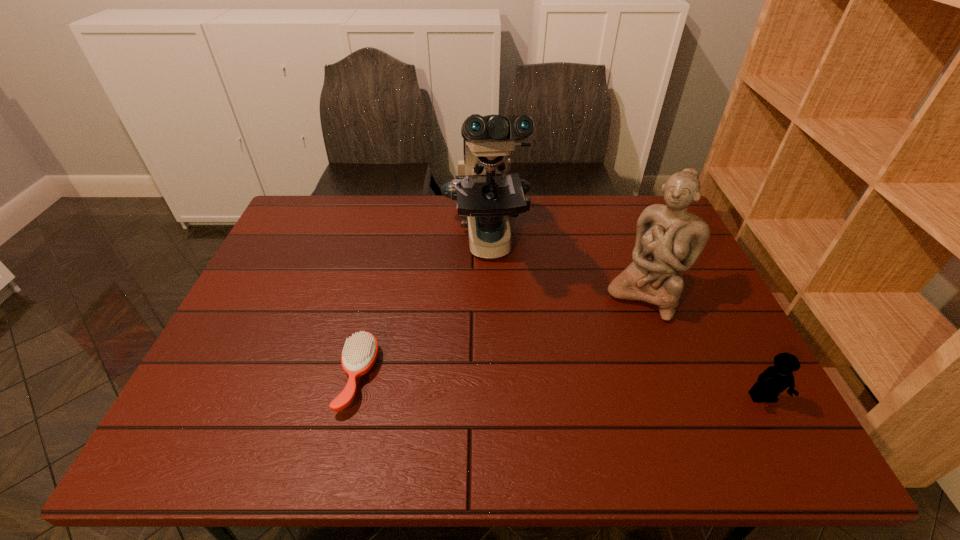
The height and width of the screenshot is (540, 960). I want to click on hairbrush, so click(x=359, y=354).

At what (x,y) coordinates should I click in order to perform the action: click on the leftmost object. Please return your answer as a coordinate pair (x, y). Looking at the image, I should click on (359, 354).

In order to click on the rightmost object in this screenshot , I will do `click(775, 379)`.

Where is `Lego`? This screenshot has width=960, height=540. Lego is located at coordinates (775, 379).

Locate an element on the screen. figurine is located at coordinates (669, 240).

Locate an element on the screen. the third shortest object is located at coordinates (669, 240).

You are a GUI agent. You are given a task and a screenshot of the screen. Output one action in this format:
    pyautogui.click(x=<x>, y=<y>)
    Task: Click on the tallest object
    This screenshot has width=960, height=540.
    Given the screenshot: What is the action you would take?
    pyautogui.click(x=485, y=191)

Find the location of a particular element. the second object from left to right is located at coordinates (485, 191).

You are a GUI agent. You are given a task and a screenshot of the screen. Output one action in this format:
    pyautogui.click(x=<x>, y=<y>)
    Task: Click on the vacant space located on the left of the shortest object
    
    Given the screenshot: What is the action you would take?
    [x=319, y=376]

Locate an element on the screen. The width and height of the screenshot is (960, 540). blank space located on the front-facing side of the third shortest object is located at coordinates (616, 338).